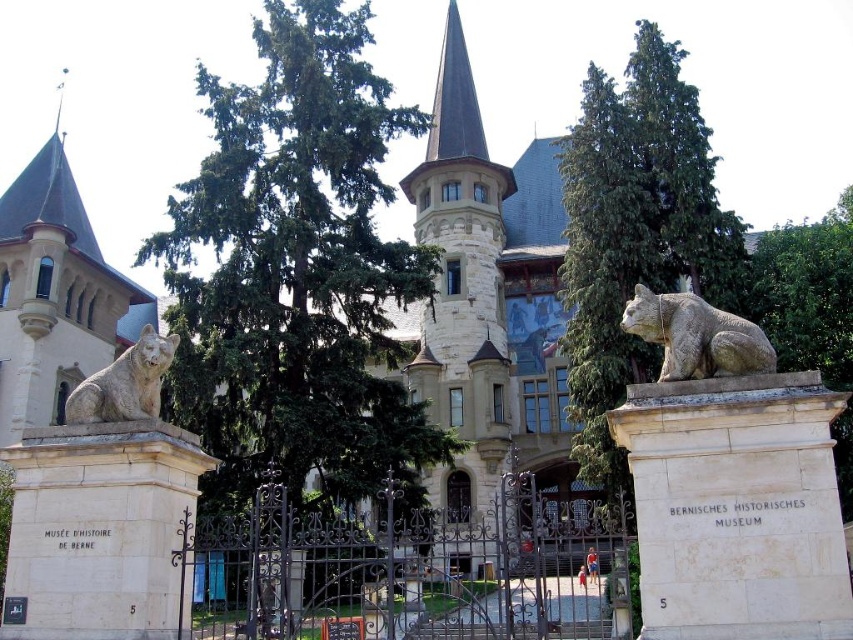
Question: Among these objects, which one is nearest to the camera?

Choices:
 (A) green leafy tree at upper right
 (B) green stone tree at center
 (C) granite bear at center

Answer: (A)

Question: Which of these objects is positioned farthest from the shiny dark gray spire at center?

Choices:
 (A) green stone tree at center
 (B) granite bear at center
 (C) green leafy tree at center
 (D) green leafy tree at upper right

Answer: (B)

Question: Among these points, which one is nearest to the camera?

Choices:
 (A) (680, 360)
 (B) (364, 428)
 (C) (825, 320)

Answer: (A)

Question: Is granite bear at center smaller than gray stone bear at left?

Choices:
 (A) yes
 (B) no

Answer: (B)

Question: Can you confirm if green stone tree at center is positioned to the left of shiny dark gray spire at center?

Choices:
 (A) no
 (B) yes

Answer: (A)

Question: Is green leafy tree at upper right closer to camera compared to gray stone bear at left?

Choices:
 (A) yes
 (B) no

Answer: (A)